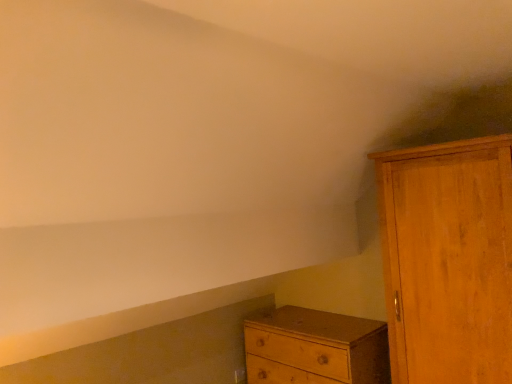
Find the location of `free space above wooden chest of drawers at lower center (from a real-world perspective)`. free space above wooden chest of drawers at lower center (from a real-world perspective) is located at coordinates (318, 325).